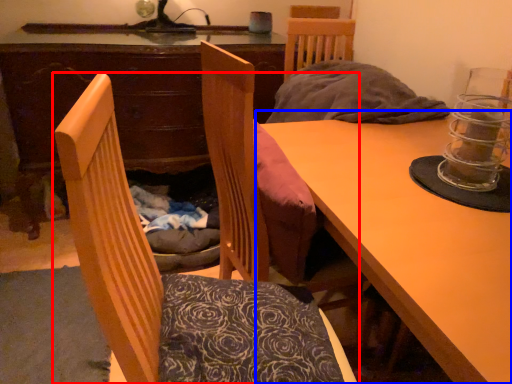
Question: Which point is closer to the camera, chair (highlighted by a red box) or table (highlighted by a blue box)?

Choices:
 (A) chair
 (B) table

Answer: (A)